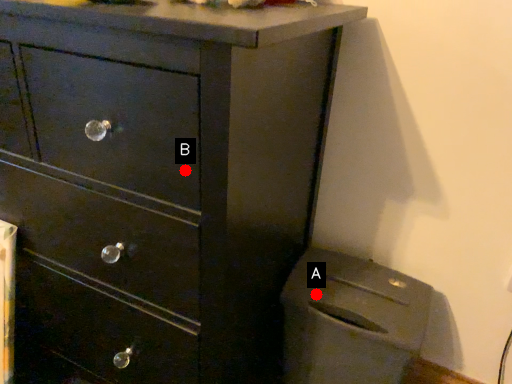
Question: Two points are circled on the image, labeled by A and B beside each circle. Which point appears closest to the camera in this image?

Choices:
 (A) A is closer
 (B) B is closer

Answer: (B)